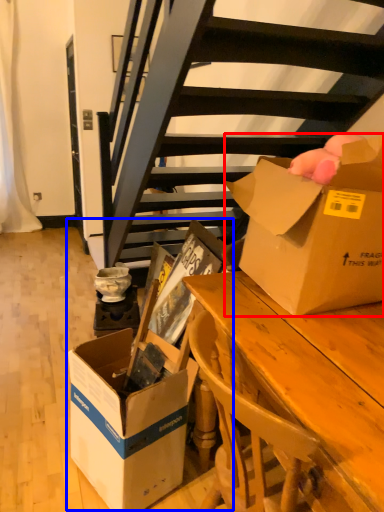
Question: Which point is closer to the camera, box (highlighted by a red box) or storage box (highlighted by a blue box)?

Choices:
 (A) box
 (B) storage box

Answer: (A)